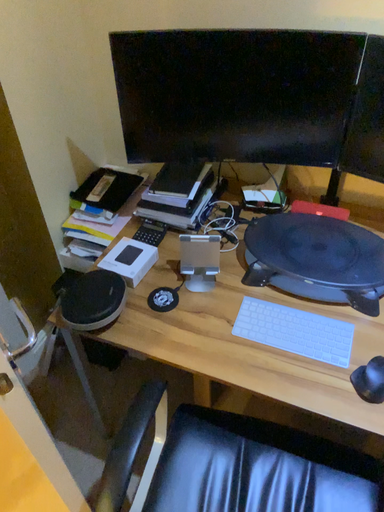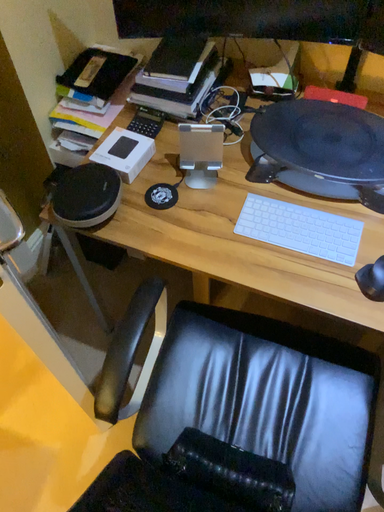
Question: How did the camera likely rotate when shooting the video?

Choices:
 (A) rotated upward
 (B) rotated downward

Answer: (B)